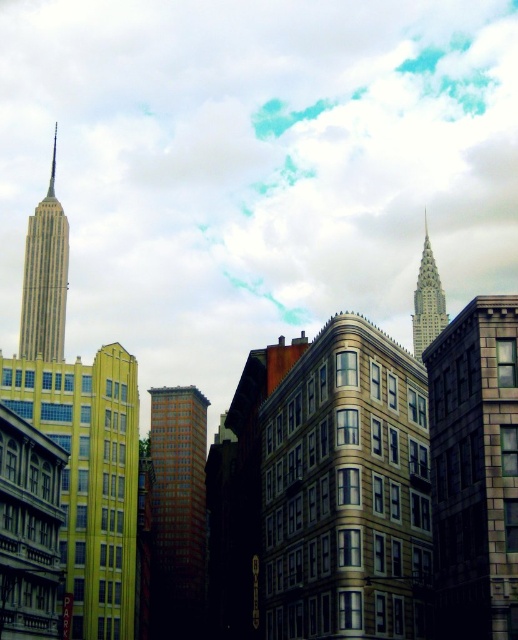
Question: Among these objects, which one is nearest to the camera?

Choices:
 (A) shiny silver spire at upper right
 (B) red brick building at center
 (C) dark gray stone building at center

Answer: (C)

Question: Which point appears closest to the camera in this image?

Choices:
 (A) (x=421, y=285)
 (B) (x=65, y=241)
 (C) (x=52, y=172)
 (D) (x=330, y=492)

Answer: (D)

Question: Is red brick building at center closer to the viewer compared to marble-like beige tower at upper left?

Choices:
 (A) no
 (B) yes

Answer: (A)

Question: Does beige stone building at center have a smaller size compared to marble-like beige tower at upper left?

Choices:
 (A) yes
 (B) no

Answer: (A)

Question: Estimate the real-world distances between objects in this image. Which object is farther from the shiny silver spire at upper right?

Choices:
 (A) marble-like beige tower at upper left
 (B) dark gray stone building at center
 (C) shiny silver spire at upper left
 (D) red brick building at center

Answer: (B)

Question: Is dark gray stone building at center positioned behind red brick building at center?

Choices:
 (A) no
 (B) yes

Answer: (A)